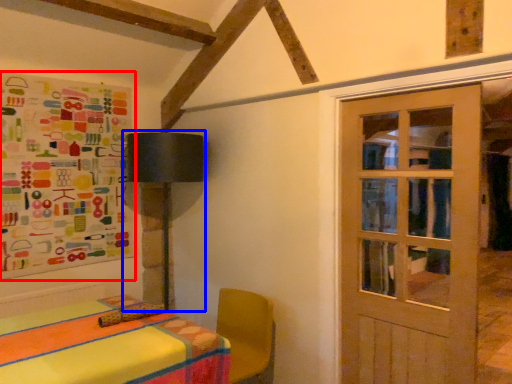
Question: Which object is closer to the camera taking this photo, bulletin board (highlighted by a red box) or table lamp (highlighted by a blue box)?

Choices:
 (A) bulletin board
 (B) table lamp

Answer: (A)